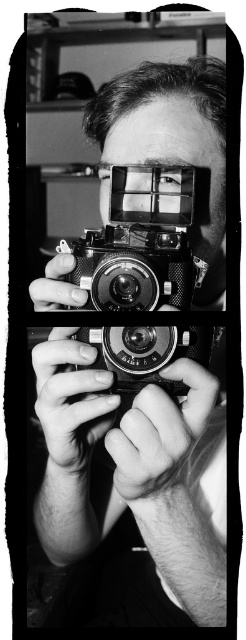
You are a photographer standing 24 inches away from the metallic silver film camera at center. Can you reach it without moving your feet?

The metallic silver film camera at center and viewer are 23.33 inches apart from each other. Since you are standing 24 inches away, you can barely reach it by stretching your arm out.

Looking at this image, you are a photographer trying to focus on the metallic silver film camera at center and the metallic camera at center in the image. Which one appears closer to you?

The metallic silver film camera at center appears closer to you because it is further to the viewer than the metallic camera at center.

You are a photographer trying to decide which camera to use for a quick portrait. You notice the metallic silver film camera at center and the metallic camera at center in the image. Based on their sizes, which one might be more portable for carrying around?

The metallic silver film camera at center is smaller than the metallic camera at center, so it would be more portable for carrying around.